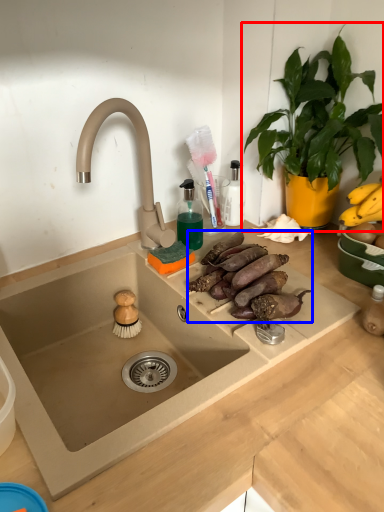
Question: Which object is closer to the camera taking this photo, houseplant (highlighted by a red box) or food (highlighted by a blue box)?

Choices:
 (A) houseplant
 (B) food

Answer: (A)